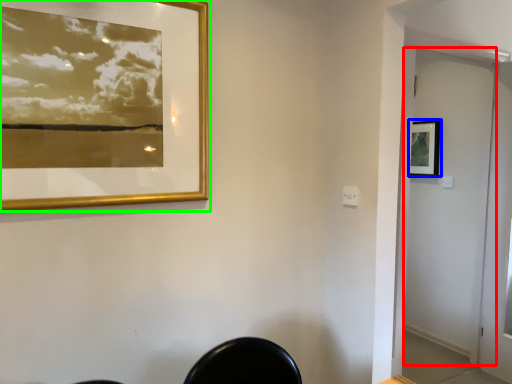
Question: Estimate the real-world distances between objects in this image. Which object is closer to screen door (highlighted by a red box), picture frame (highlighted by a blue box) or picture frame (highlighted by a green box)?

Choices:
 (A) picture frame
 (B) picture frame

Answer: (A)